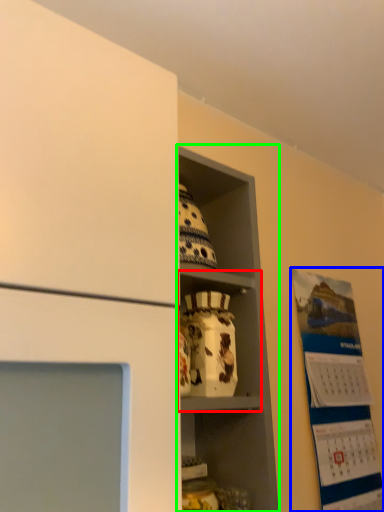
Question: Which is nearer to the cabinet (highlighted by a red box)? bulletin board (highlighted by a blue box) or shelf (highlighted by a green box).

Choices:
 (A) bulletin board
 (B) shelf

Answer: (B)